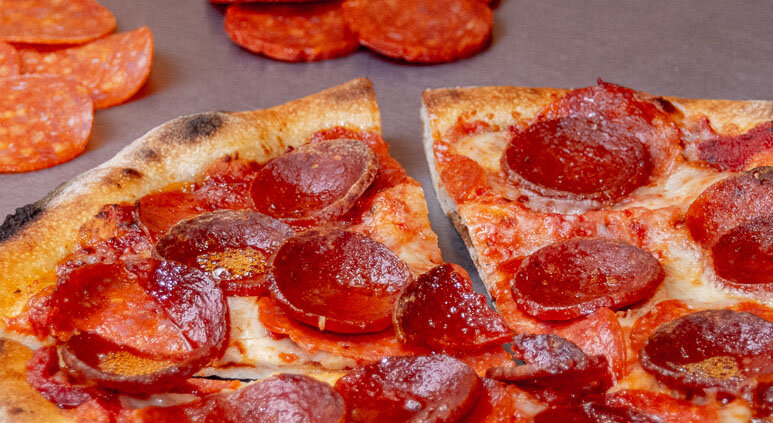
Find the location of `pepperoni slices on table surface`. pepperoni slices on table surface is located at coordinates (410, 41), (318, 34), (120, 61), (66, 22), (5, 58), (36, 124).